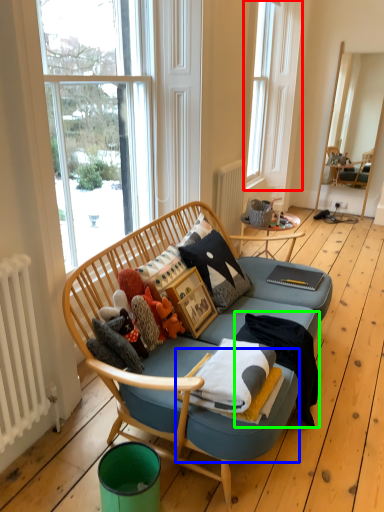
Question: Considering the real-world distances, which object is farthest from window (highlighted by a red box)? footrest (highlighted by a blue box) or blanket (highlighted by a green box)?

Choices:
 (A) footrest
 (B) blanket

Answer: (A)